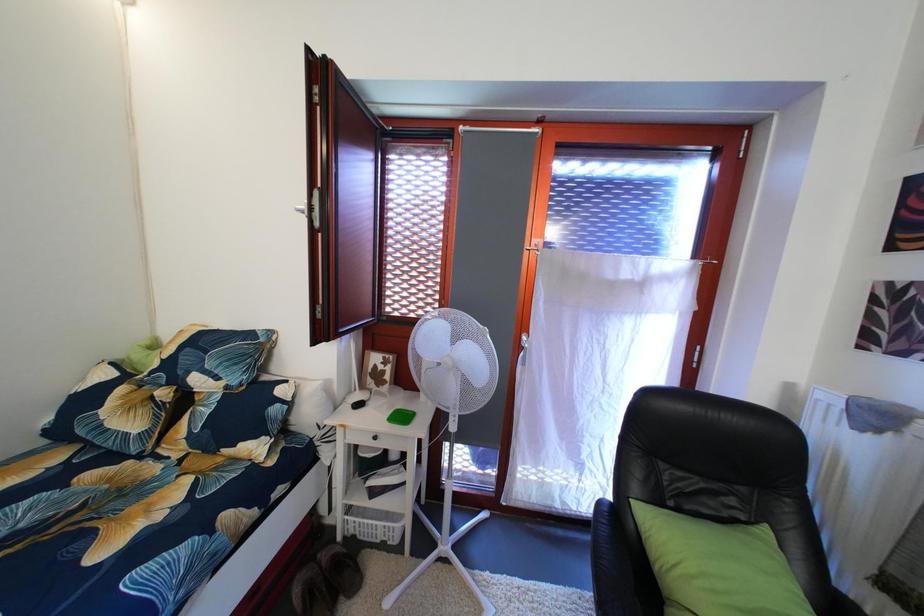
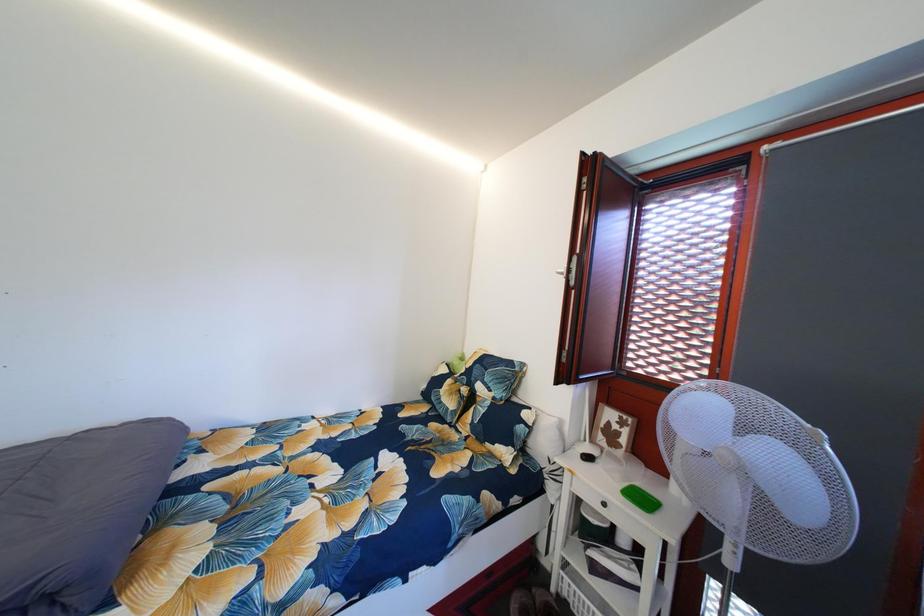
Question: The camera is either moving clockwise (left) or counter-clockwise (right) around the object. The first image is from the beginning of the video and the second image is from the end. Is the camera moving left or right when shooting the video?

Choices:
 (A) Left
 (B) Right

Answer: (B)